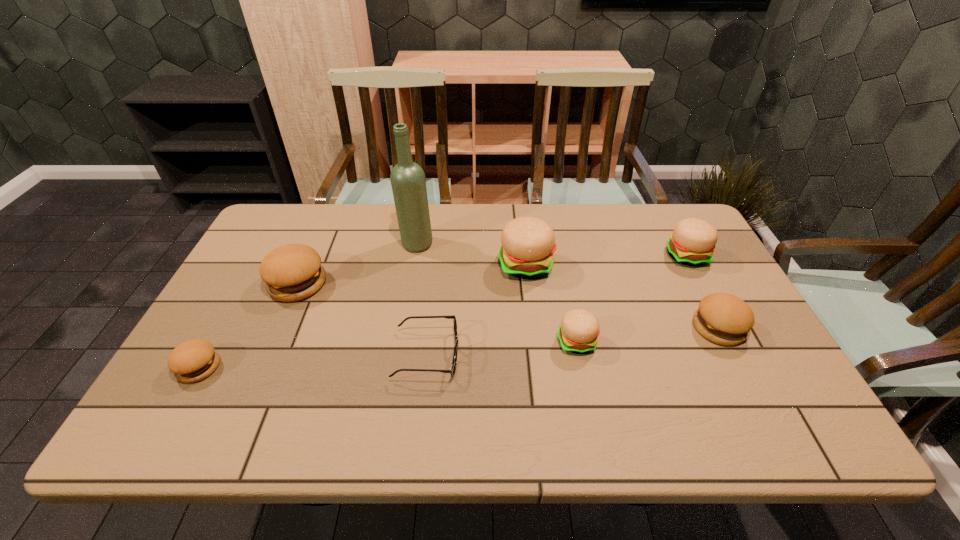
This screenshot has height=540, width=960. In order to click on free space that is in between the leftmost hamburger and the smallest beige hamburger in this screenshot , I will do `click(388, 354)`.

The height and width of the screenshot is (540, 960). I want to click on vacant area between the biggest beige hamburger and the biggest brown hamburger, so click(412, 274).

Identify the location of free area in between the biggest beige hamburger and the second biggest beige hamburger. This screenshot has height=540, width=960. (606, 260).

Where is `vacant region between the second nearest brown hamburger and the nearest beige hamburger`? The image size is (960, 540). vacant region between the second nearest brown hamburger and the nearest beige hamburger is located at coordinates (647, 335).

Find the location of a particular element. The image size is (960, 540). free spot between the biggest brown hamburger and the shortest object is located at coordinates (362, 319).

Where is `free space that is in between the shortest hamburger and the second tallest object`? The height and width of the screenshot is (540, 960). free space that is in between the shortest hamburger and the second tallest object is located at coordinates (362, 316).

Identify the location of blank region between the nearest brown hamburger and the green wine bottle. (308, 306).

The image size is (960, 540). I want to click on vacant space in between the smallest beige hamburger and the spectacles, so click(x=502, y=348).

Find the location of a particular element. blank region between the nearest beige hamburger and the wine bottle is located at coordinates [x=496, y=293].

The height and width of the screenshot is (540, 960). I want to click on object identified as the fourth closest to the second biggest beige hamburger, so click(x=452, y=370).